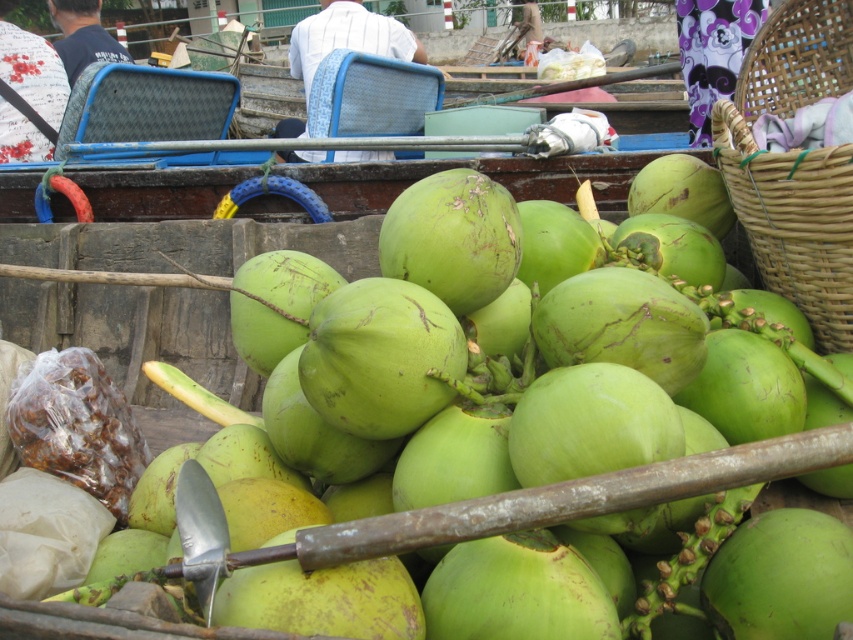
Which is above, green rough coconut at center or woven bamboo basket at right?

woven bamboo basket at right is higher up.

The width and height of the screenshot is (853, 640). I want to click on green rough coconut at center, so click(523, 372).

Where is `green rough coconut at center`? This screenshot has width=853, height=640. green rough coconut at center is located at coordinates (523, 372).